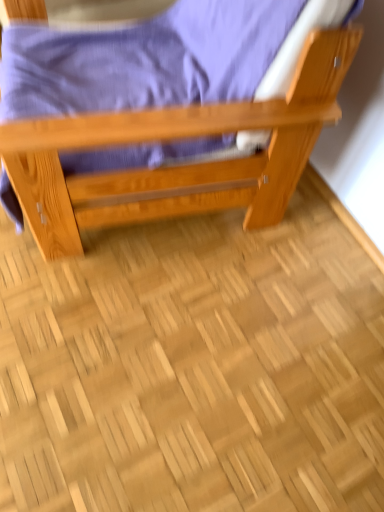
Image resolution: width=384 pixels, height=512 pixels. What do you see at coordinates (177, 166) in the screenshot? I see `natural wood bed frame at upper center` at bounding box center [177, 166].

Measure the distance between point (20, 143) and camera.

Point (20, 143) is 81.80 centimeters away from camera.

I want to click on natural wood bed frame at upper center, so click(177, 166).

You are a GUI agent. You are given a task and a screenshot of the screen. Output one action in this format:
    pyautogui.click(x=<x>, y=<y>)
    Task: Click on the natural wood bed frame at upper center
    The image size is (384, 512).
    Given the screenshot: What is the action you would take?
    pyautogui.click(x=177, y=166)